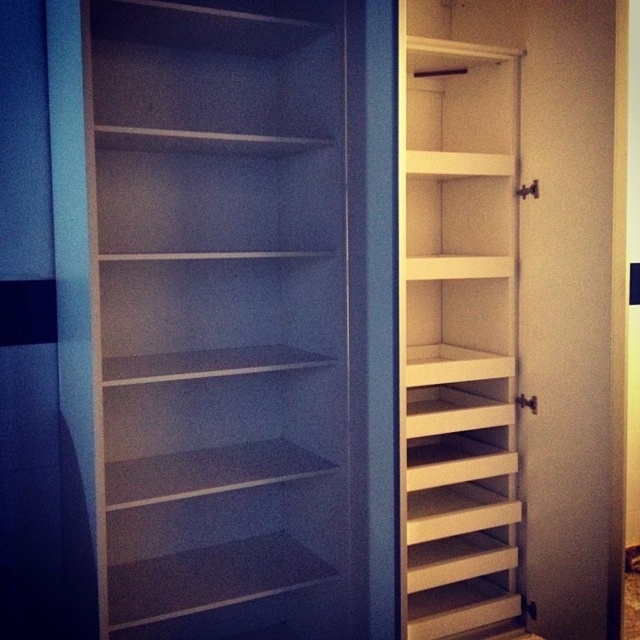
What are the coordinates of the white matte bookshelf at left?

The white matte bookshelf at left is located at coordinates point (225, 314).

You are organizing books in a library. You need to place a large dictionary that requires a sturdy, flat surface. Which bookshelf should you choose between the white matte bookshelf at left and the white wood bookshelf at right?

The white matte bookshelf at left is below the white wood bookshelf at right. Since the white matte bookshelf at left is a larger built unit with sturdy shelves, it would provide a more stable and flat surface for placing the large dictionary compared to the smaller white wood bookshelf at right.